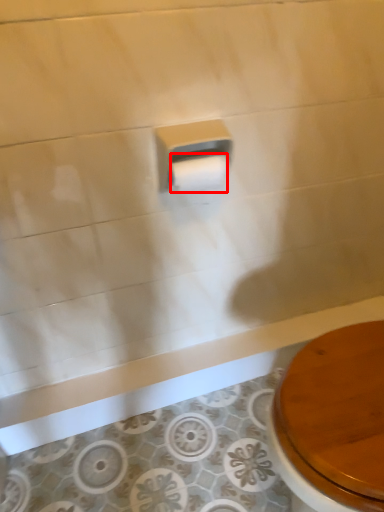
Question: Observing the image, what is the correct spatial positioning of toilet paper (annotated by the red box) in reference to toilet paper?

Choices:
 (A) right
 (B) left

Answer: (A)